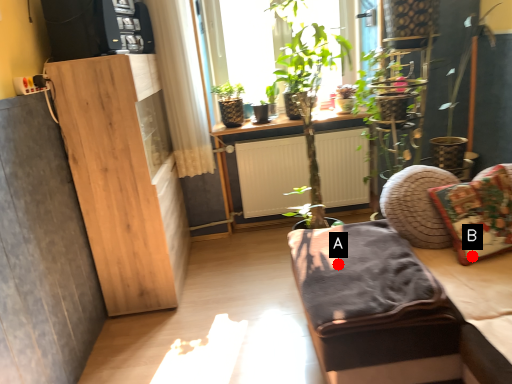
Question: Two points are circled on the image, labeled by A and B beside each circle. Which point is further to the camera?

Choices:
 (A) A is further
 (B) B is further

Answer: (A)